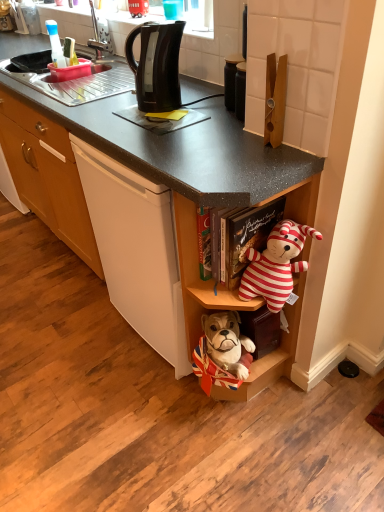
Image resolution: width=384 pixels, height=512 pixels. In order to click on vacant area that is in front of black plastic kettle at center in this screenshot , I will do `click(161, 406)`.